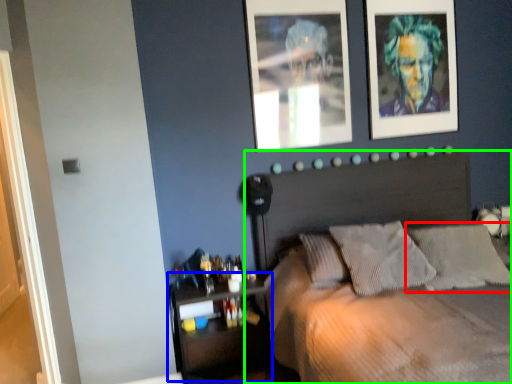
Question: Considering the real-world distances, which object is farthest from pillow (highlighted by a red box)? shelf (highlighted by a blue box) or bed (highlighted by a green box)?

Choices:
 (A) shelf
 (B) bed

Answer: (A)